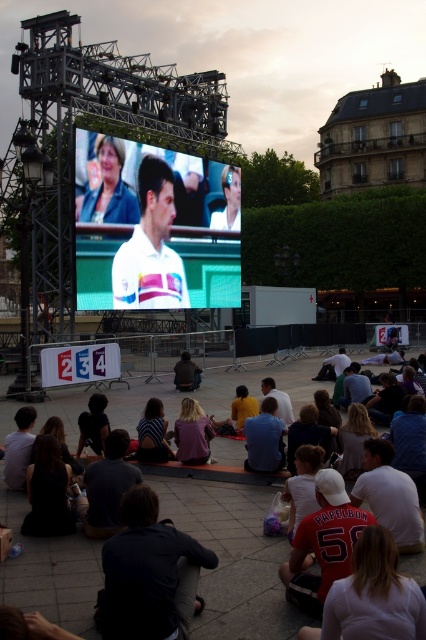
You are a photographer at the event and want to capture both the white glossy tennis player at center and the striped fabric shirt at center in a single frame. Which object should you focus on first to ensure both are in the frame?

The white glossy tennis player at center is wider than the striped fabric shirt at center, so focusing on the white glossy tennis player at center first will ensure both are included in the frame.